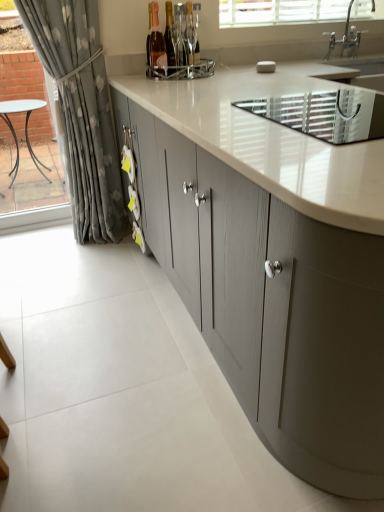
You are a GUI agent. You are given a task and a screenshot of the screen. Output one action in this format:
    pyautogui.click(x=<x>, y=<y>)
    Task: Click on the unoccupied area in front of clear glass window frame at left
    This screenshot has height=512, width=384.
    Given the screenshot: What is the action you would take?
    pyautogui.click(x=32, y=244)